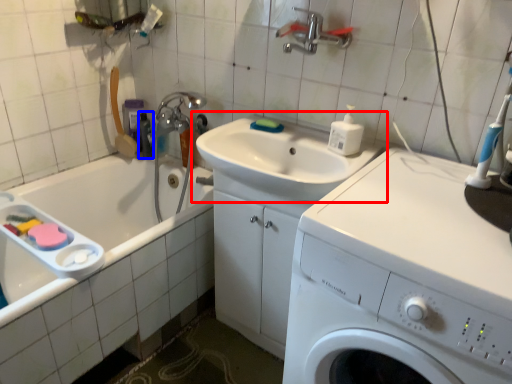
Question: Which object is further to the camera taking this photo, sink (highlighted by a red box) or toiletry (highlighted by a blue box)?

Choices:
 (A) sink
 (B) toiletry

Answer: (B)